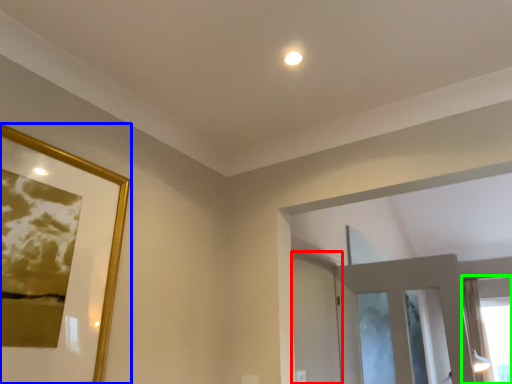
Question: Which is farther away from screen door (highlighted by a red box)? picture frame (highlighted by a blue box) or window (highlighted by a green box)?

Choices:
 (A) picture frame
 (B) window

Answer: (B)